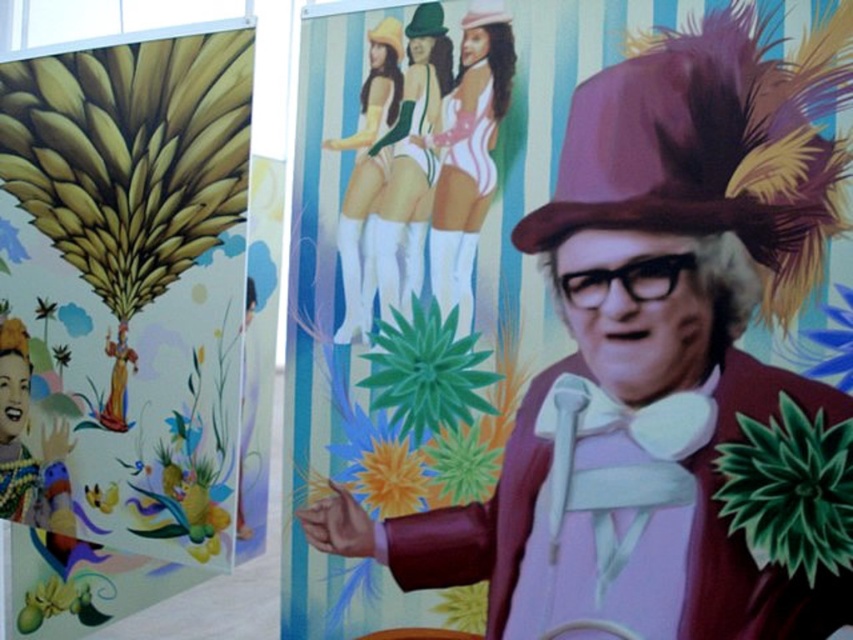
Is brown feathered hat at upper right positioned in front of matte pink swimsuit at center?

Yes, it is in front of matte pink swimsuit at center.

Image resolution: width=853 pixels, height=640 pixels. Identify the location of brown feathered hat at upper right. click(x=712, y=147).

Identify the location of brown feathered hat at upper right. (712, 147).

Is matte burgundy coat at center closer to the viewer compared to brown feathered hat at upper right?

Yes.

Between matte burgundy coat at center and brown feathered hat at upper right, which one appears on the left side from the viewer's perspective?

From the viewer's perspective, matte burgundy coat at center appears more on the left side.

Measure the distance between matte burgundy coat at center and camera.

matte burgundy coat at center and camera are 1.34 meters apart from each other.

You are a GUI agent. You are given a task and a screenshot of the screen. Output one action in this format:
    pyautogui.click(x=<x>, y=<y>)
    Task: Click on the matte burgundy coat at center
    
    Given the screenshot: What is the action you would take?
    pyautogui.click(x=653, y=353)

Which is in front, point (604, 310) or point (184, 189)?

Positioned in front is point (604, 310).

Does matte burgundy coat at center appear on the right side of gold leaf mural at left?

Indeed, matte burgundy coat at center is positioned on the right side of gold leaf mural at left.

Is point (670, 44) positioned after point (236, 131)?

No, (670, 44) is in front of (236, 131).

This screenshot has width=853, height=640. I want to click on matte burgundy coat at center, so click(653, 353).